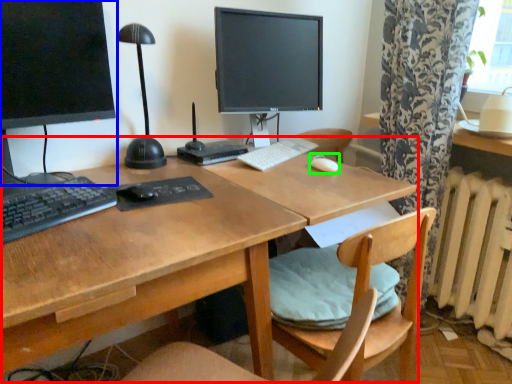
Question: Estimate the real-world distances between objects in this image. Which object is closer to desk (highlighted by a red box), computer monitor (highlighted by a blue box) or mouse (highlighted by a green box)?

Choices:
 (A) computer monitor
 (B) mouse

Answer: (A)